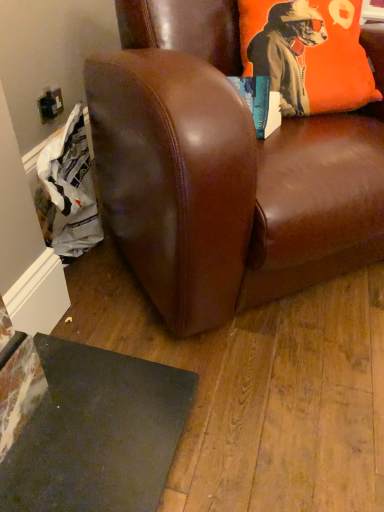
Question: Can you confirm if orange fabric pillow at upper right is wider than brown leather chair at center?

Choices:
 (A) no
 (B) yes

Answer: (A)

Question: Does orange fabric pillow at upper right appear on the right side of brown leather chair at center?

Choices:
 (A) no
 (B) yes

Answer: (B)

Question: From the image's perspective, is orange fabric pillow at upper right on top of brown leather chair at center?

Choices:
 (A) no
 (B) yes

Answer: (B)

Question: Is orange fabric pillow at upper right smaller than brown leather chair at center?

Choices:
 (A) yes
 (B) no

Answer: (A)

Question: Can you confirm if orange fabric pillow at upper right is shorter than brown leather chair at center?

Choices:
 (A) yes
 (B) no

Answer: (A)

Question: Considering the relative sizes of orange fabric pillow at upper right and brown leather chair at center in the image provided, is orange fabric pillow at upper right thinner than brown leather chair at center?

Choices:
 (A) yes
 (B) no

Answer: (A)

Question: Is brown leather chair at center outside orange fabric pillow at upper right?

Choices:
 (A) no
 (B) yes

Answer: (B)

Question: From a real-world perspective, is brown leather chair at center under orange fabric pillow at upper right?

Choices:
 (A) yes
 (B) no

Answer: (A)

Question: Is the depth of brown leather chair at center greater than that of orange fabric pillow at upper right?

Choices:
 (A) no
 (B) yes

Answer: (A)

Question: Does brown leather chair at center have a greater width compared to orange fabric pillow at upper right?

Choices:
 (A) yes
 (B) no

Answer: (A)

Question: Does brown leather chair at center have a lesser height compared to orange fabric pillow at upper right?

Choices:
 (A) yes
 (B) no

Answer: (B)

Question: Is brown leather chair at center smaller than orange fabric pillow at upper right?

Choices:
 (A) no
 (B) yes

Answer: (A)

Question: Considering the positions of orange fabric pillow at upper right and brown leather chair at center in the image, is orange fabric pillow at upper right taller or shorter than brown leather chair at center?

Choices:
 (A) tall
 (B) short

Answer: (B)